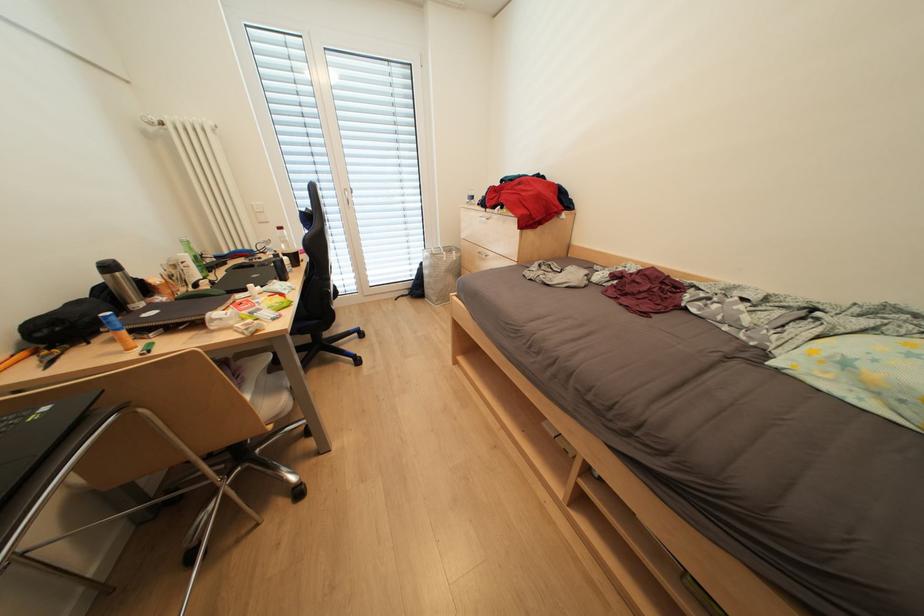
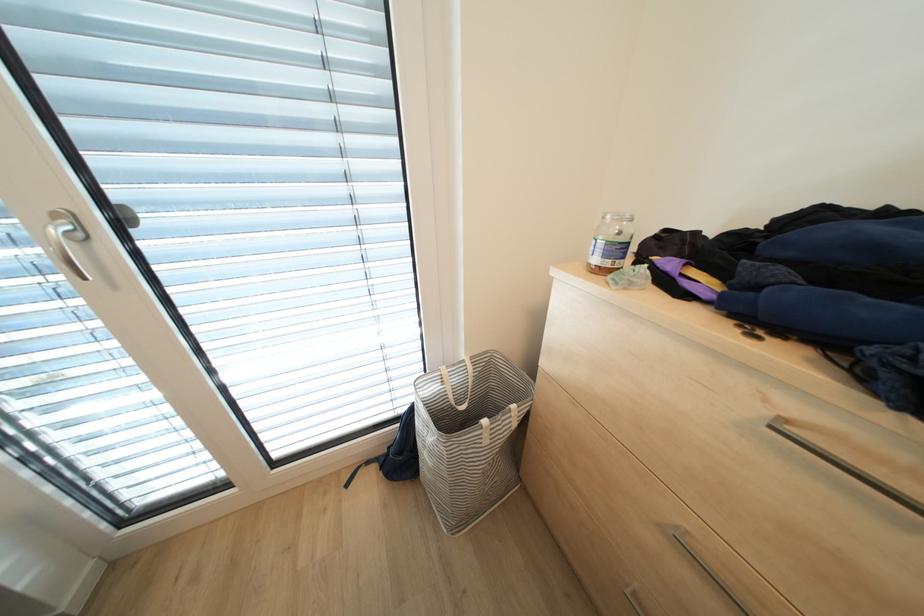
Question: In a continuous first-person perspective shot, in which direction is the camera moving?

Choices:
 (A) Left
 (B) Right
 (C) Forward
 (D) Backward

Answer: (C)